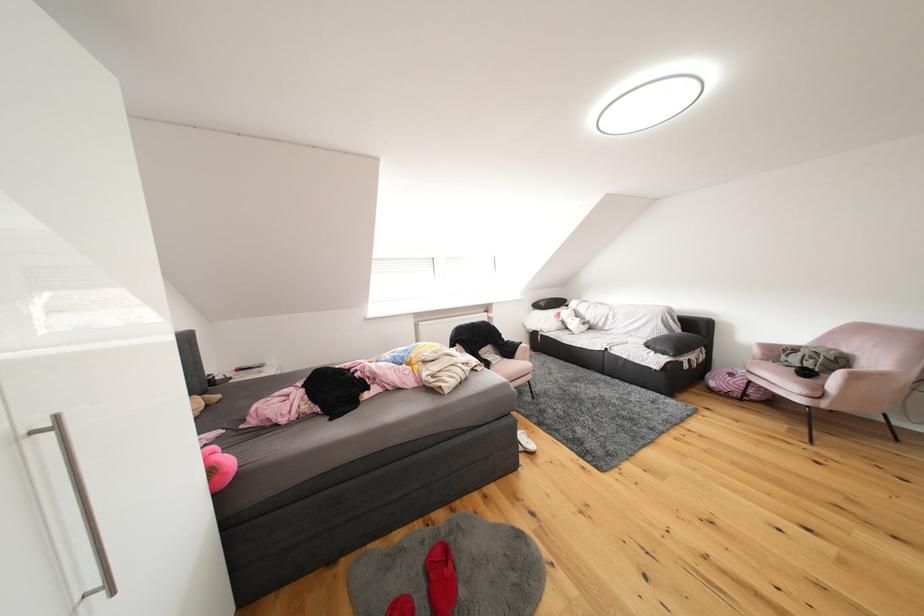
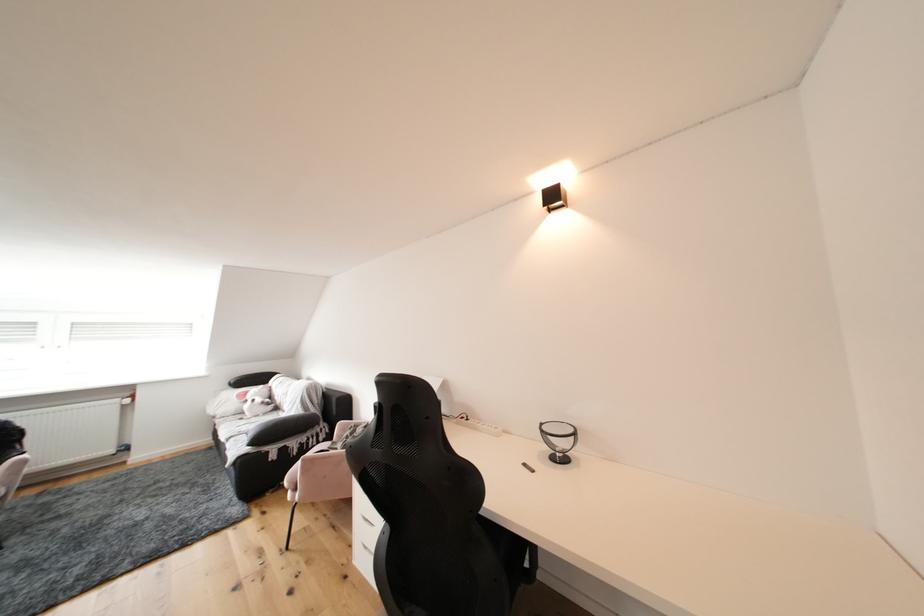
Question: The images are taken continuously from a first-person perspective. In which direction are you moving?

Choices:
 (A) Left
 (B) Right
 (C) Forward
 (D) Backward

Answer: (B)